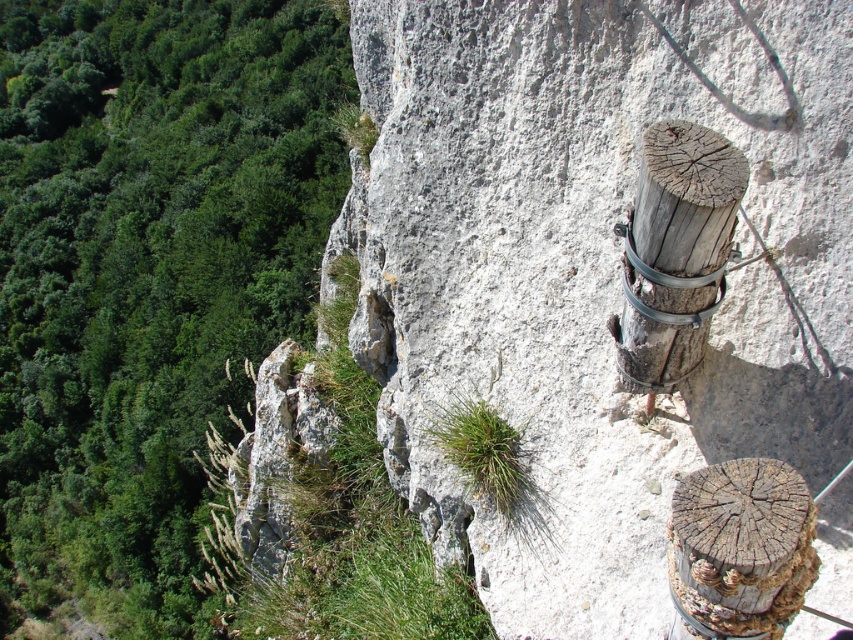
Is smooth gray rock at center taller than weathered wood post at right?

Correct, smooth gray rock at center is much taller as weathered wood post at right.

Is smooth gray rock at center bigger than weathered wood post at right?

Yes.

Is point (618, 38) positioned in front of point (699, 340)?

No, it is not.

Image resolution: width=853 pixels, height=640 pixels. Find the location of `smooth gray rock at center`. smooth gray rock at center is located at coordinates (593, 269).

Can you confirm if green leafy vegetation at left is wider than weathered wood post at right?

Yes.

Does green leafy vegetation at left come behind weathered wood post at right?

Yes, green leafy vegetation at left is behind weathered wood post at right.

At what (x,y) coordinates should I click in order to perform the action: click on green leafy vegetation at left. Please return your answer as a coordinate pair (x, y). This screenshot has height=640, width=853. Looking at the image, I should click on (146, 275).

The height and width of the screenshot is (640, 853). In order to click on green leafy vegetation at left in this screenshot , I will do `click(146, 275)`.

Which of these two, smooth gray rock at center or green leafy vegetation at left, stands shorter?

Standing shorter between the two is smooth gray rock at center.

Locate an element on the screen. Image resolution: width=853 pixels, height=640 pixels. smooth gray rock at center is located at coordinates (593, 269).